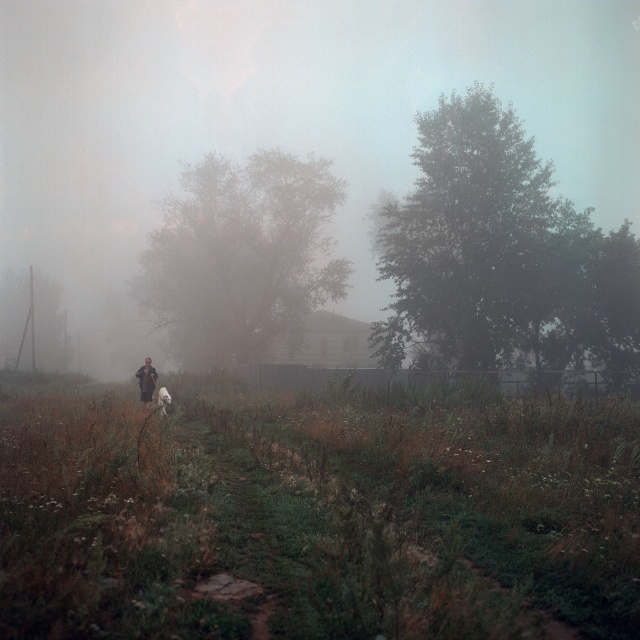
Who is lower down, foggy translucent morning fog at center or dark brown leather jacket at center?

dark brown leather jacket at center is below.

Between point (51, 195) and point (145, 400), which one is positioned in front?

Point (145, 400)

Is point (26, 106) positioned behind point (141, 378)?

Yes.

The width and height of the screenshot is (640, 640). In order to click on foggy translucent morning fog at center in this screenshot , I will do `click(276, 122)`.

Is point (148, 381) positioned before point (164, 400)?

No.

Is dark brown leather jacket at center smaller than white fluffy dog at center?

Incorrect, dark brown leather jacket at center is not smaller in size than white fluffy dog at center.

Who is more forward, (147, 397) or (170, 397)?

Point (147, 397)

In order to click on dark brown leather jacket at center in this screenshot , I will do `click(147, 381)`.

Between foggy translucent morning fog at center and white fluffy dog at center, which one is positioned lower?

Positioned lower is white fluffy dog at center.

Does foggy translucent morning fog at center appear under white fluffy dog at center?

No.

Is point (380, 177) less distant than point (161, 403)?

No, (380, 177) is behind (161, 403).

Find the location of `foggy translucent morning fog at center`. foggy translucent morning fog at center is located at coordinates click(x=276, y=122).